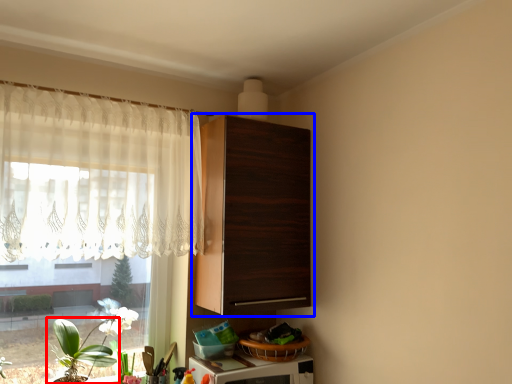
Question: Among these objects, which one is farthest to the camera, houseplant (highlighted by a red box) or cabinetry (highlighted by a blue box)?

Choices:
 (A) houseplant
 (B) cabinetry

Answer: (B)